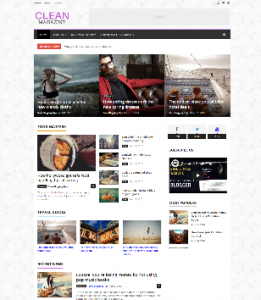
Where is `picture`? The height and width of the screenshot is (300, 261). picture is located at coordinates (x=83, y=152).